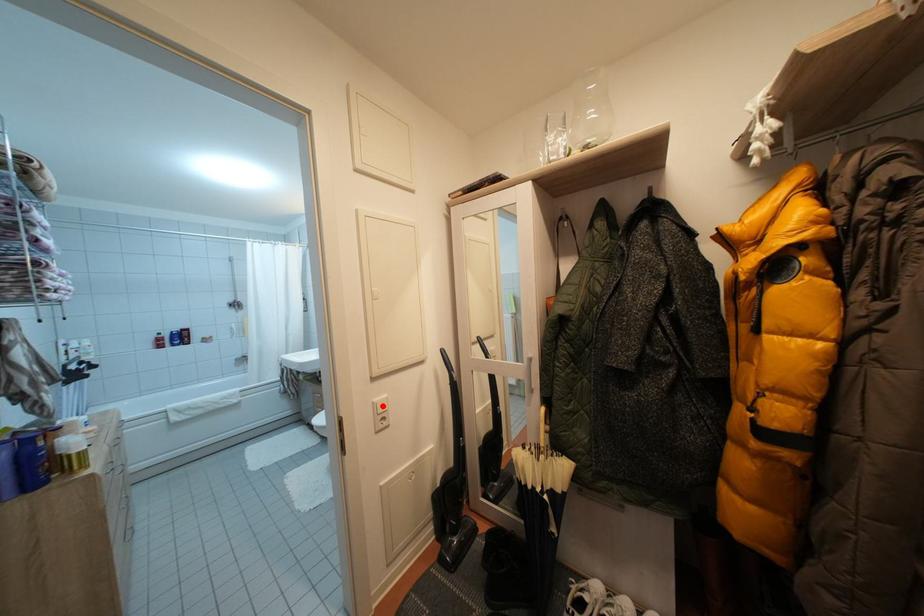
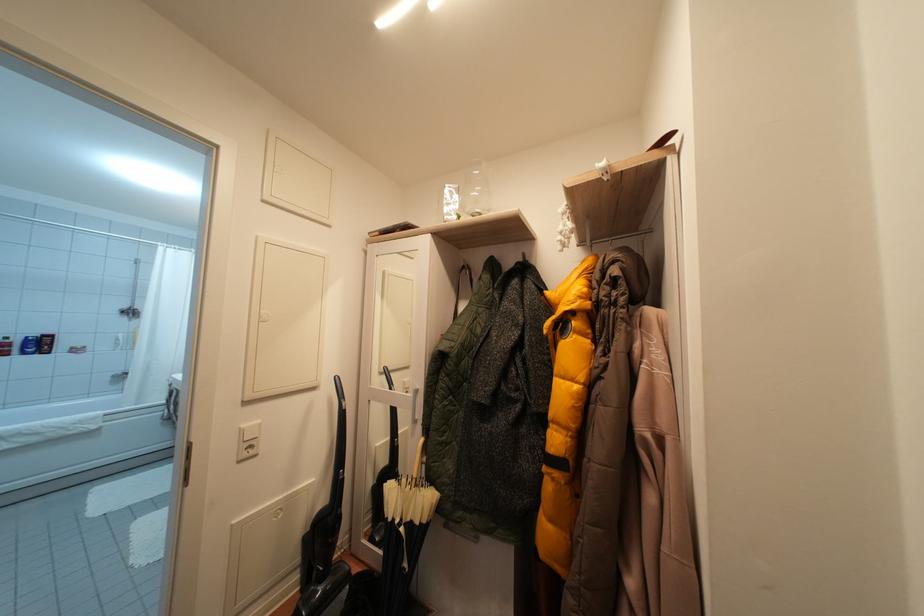
Question: I am providing you with two images of the same scene from different viewpoints. A red point is marked on the first image. At the location where the point appears in image 1, is it still visible in image 2?

Choices:
 (A) Yes
 (B) No

Answer: (A)